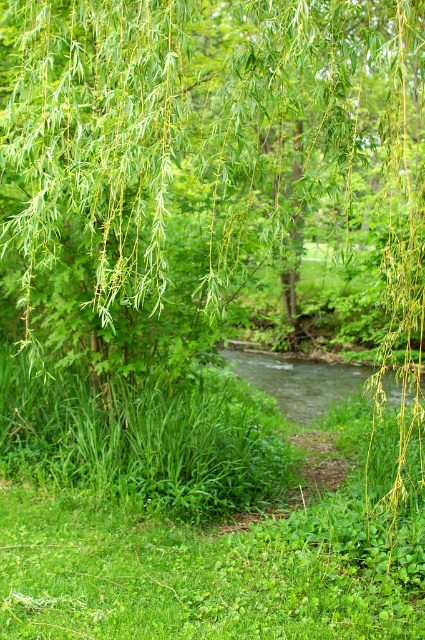
Question: Which point is closer to the camera?

Choices:
 (A) (396, 84)
 (B) (113, 420)

Answer: (A)

Question: Does green leafy grass at center have a larger size compared to green grassy creek at center?

Choices:
 (A) yes
 (B) no

Answer: (B)

Question: Does green leafy willow at upper center come behind green leafy grass at center?

Choices:
 (A) yes
 (B) no

Answer: (B)

Question: Which point is farther to the camera?

Choices:
 (A) (328, 385)
 (B) (70, 541)

Answer: (A)

Question: Estimate the real-world distances between objects in this image. Which object is closer to the green leafy grass at center?

Choices:
 (A) green leafy willow at upper center
 (B) green grassy creek at center

Answer: (A)

Question: Is green leafy grass at center in front of green grassy creek at center?

Choices:
 (A) yes
 (B) no

Answer: (B)